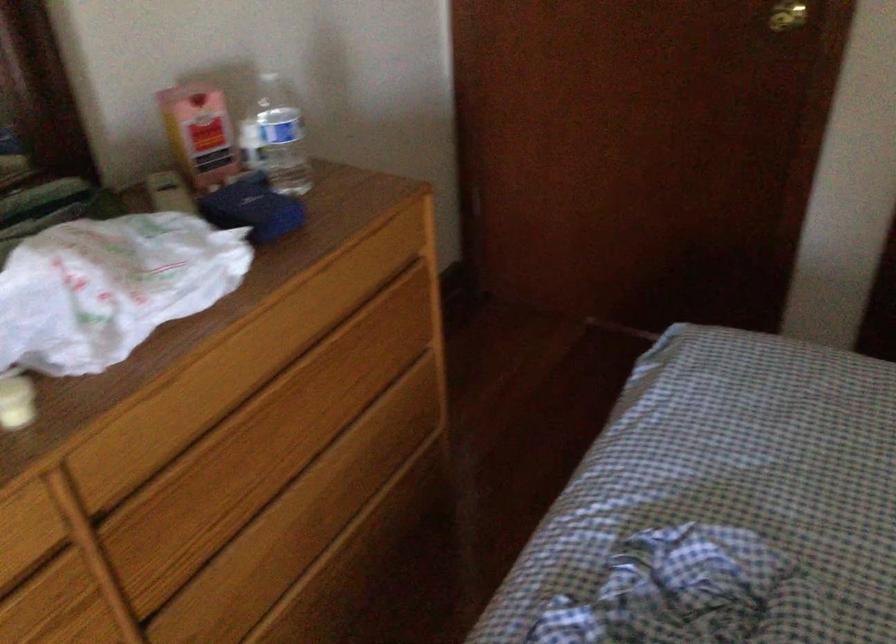
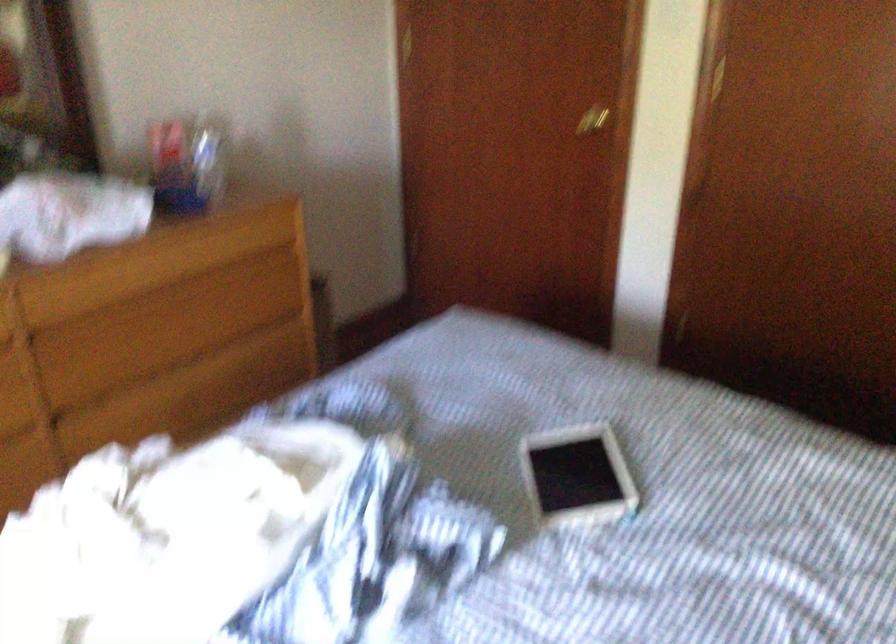
In a continuous first-person perspective shot, in which direction is the camera moving?

The cameraman walked toward right, backward.